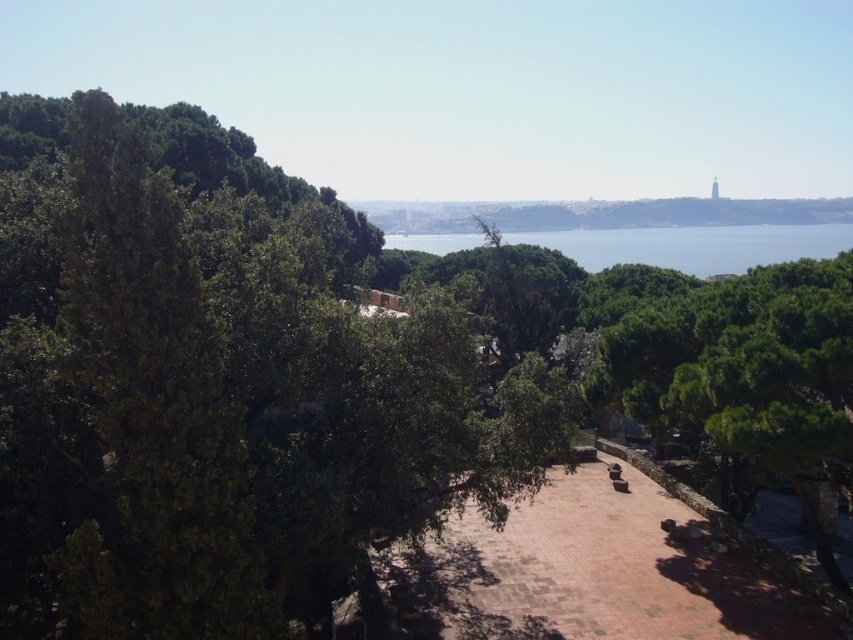
You are standing at the viewpoint overlooking the landscape and want to determine the relative positions of two points marked in the scene. Which point, point (447, 321) or point (822, 216), is closer to you?

Point (447, 321) is closer to the viewer than point (822, 216).

You are standing on the pathway and want to take a photo of both the clear blue water at center and the green leafy hillside at center. Which object should you point your camera towards first if you want to capture both in your shot?

You should point your camera towards the green leafy hillside at center first because it is above the clear blue water at center, allowing both to be captured in the same frame.